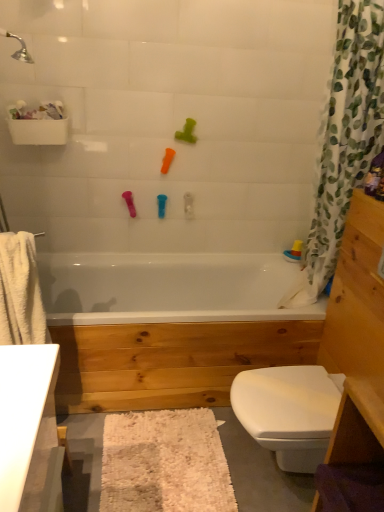
Identify the location of empty space that is ontop of white shaggy bath mat at lower center (from a real-world perspective). The width and height of the screenshot is (384, 512). (166, 453).